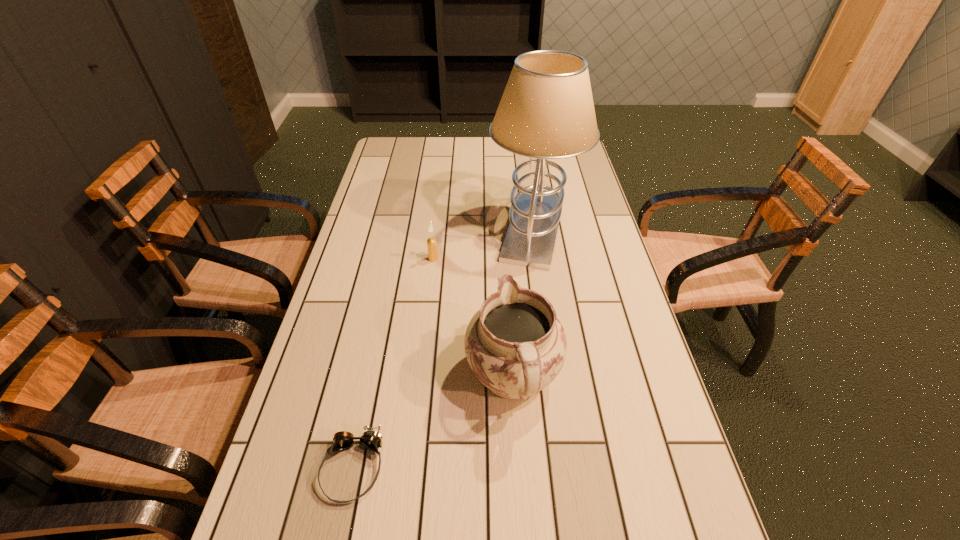
The height and width of the screenshot is (540, 960). Identify the location of the tallest object. (546, 111).

Find the location of a particular element. the third farthest object is located at coordinates (516, 346).

You are a GUI agent. You are given a task and a screenshot of the screen. Output one action in this format:
    pyautogui.click(x=<x>, y=<y>)
    Task: Click on the pitcher
    The width and height of the screenshot is (960, 540).
    Given the screenshot: What is the action you would take?
    pyautogui.click(x=516, y=346)

At what (x,y) coordinates should I click in order to perform the action: click on the third tallest object. Please return your answer as a coordinate pair (x, y). The height and width of the screenshot is (540, 960). Looking at the image, I should click on (431, 242).

The image size is (960, 540). Identify the location of the second object from left to right. (431, 242).

Find the location of `goggles`. goggles is located at coordinates (370, 439).

The width and height of the screenshot is (960, 540). I want to click on the nearest object, so click(x=370, y=439).

Find the location of a particular element. vacant space situated 0.180m on the left of the tallest object is located at coordinates (432, 227).

Where is `vacant space located on the spout of the third farthest object`? vacant space located on the spout of the third farthest object is located at coordinates (506, 261).

This screenshot has height=540, width=960. I want to click on free location located 0.180m on the spout of the third farthest object, so click(x=507, y=282).